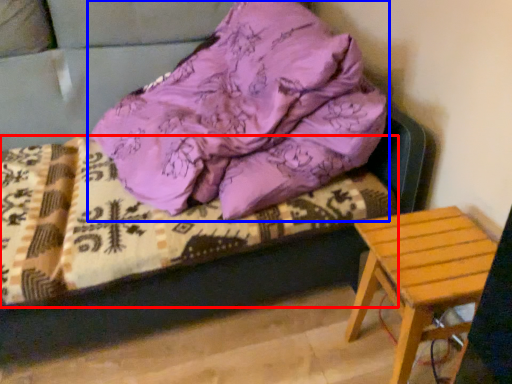
Question: Which object appears closest to the camera in this image, bedding (highlighted by a red box) or pillow (highlighted by a blue box)?

Choices:
 (A) bedding
 (B) pillow

Answer: (B)